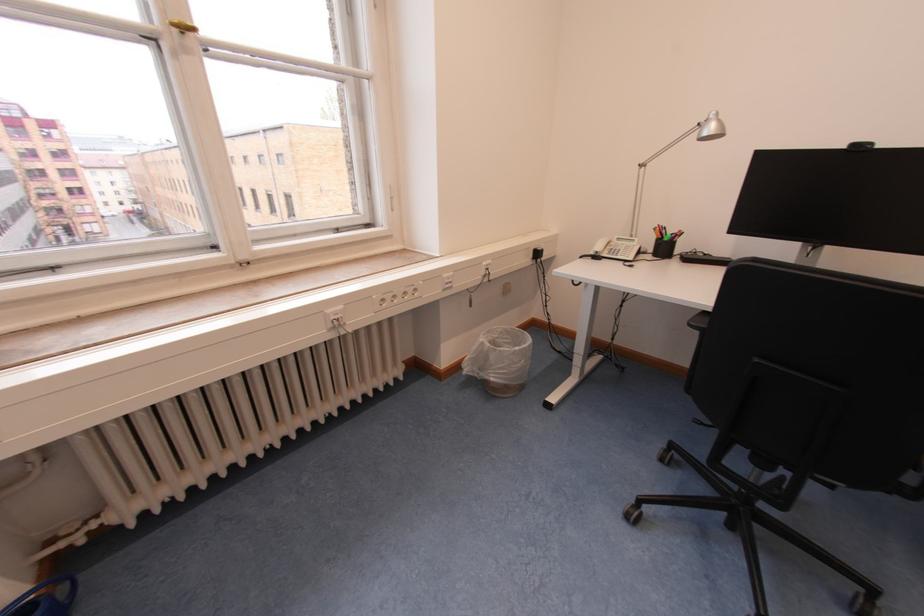
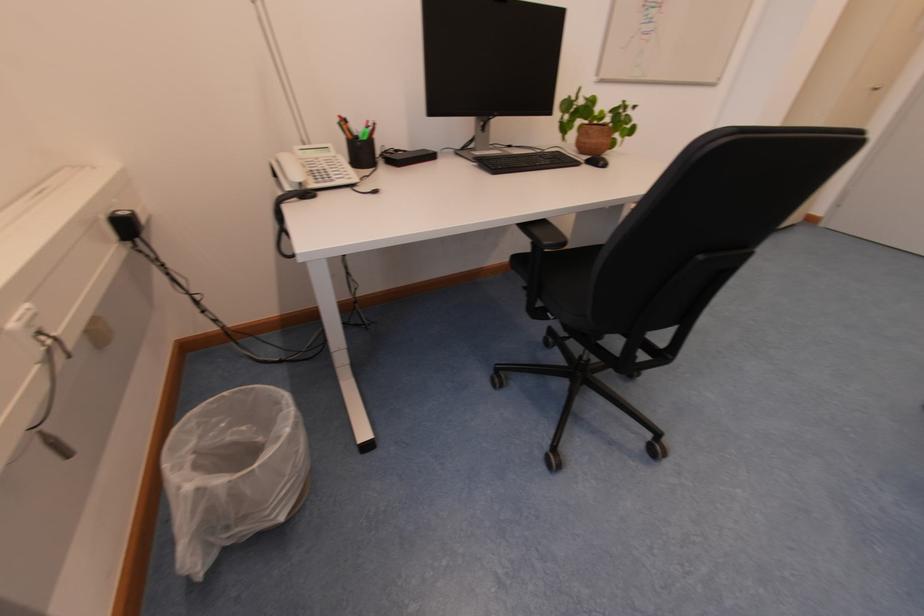
Find the pixel in the second image that matches pixel 540 251 in the first image.

(111, 220)